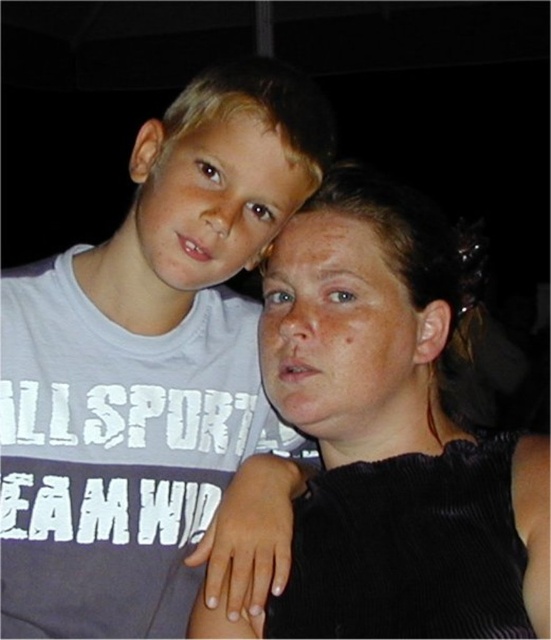
Between matte gray t-shirt at left and black corduroy top at center, which one appears on the left side from the viewer's perspective?

matte gray t-shirt at left is more to the left.

Can you confirm if matte gray t-shirt at left is positioned below black corduroy top at center?

Actually, matte gray t-shirt at left is above black corduroy top at center.

At what (x,y) coordinates should I click in order to perform the action: click on matte gray t-shirt at left. Please return your answer as a coordinate pair (x, y). Image resolution: width=551 pixels, height=640 pixels. Looking at the image, I should click on click(x=155, y=378).

Does matte gray t-shirt at left appear over smooth skin face at upper left?

Actually, matte gray t-shirt at left is below smooth skin face at upper left.

Who is positioned more to the right, matte gray t-shirt at left or smooth skin face at upper left?

smooth skin face at upper left is more to the right.

Where is `matte gray t-shirt at left`? This screenshot has height=640, width=551. matte gray t-shirt at left is located at coordinates (155, 378).

Does black corduroy top at center have a larger size compared to smooth skin face at upper left?

Yes.

Is black corduroy top at center wider than smooth skin face at upper left?

Correct, the width of black corduroy top at center exceeds that of smooth skin face at upper left.

Measure the distance between black corduroy top at center and camera.

black corduroy top at center is 26.36 inches away from camera.

Where is `black corduroy top at center`? The height and width of the screenshot is (640, 551). black corduroy top at center is located at coordinates (391, 435).